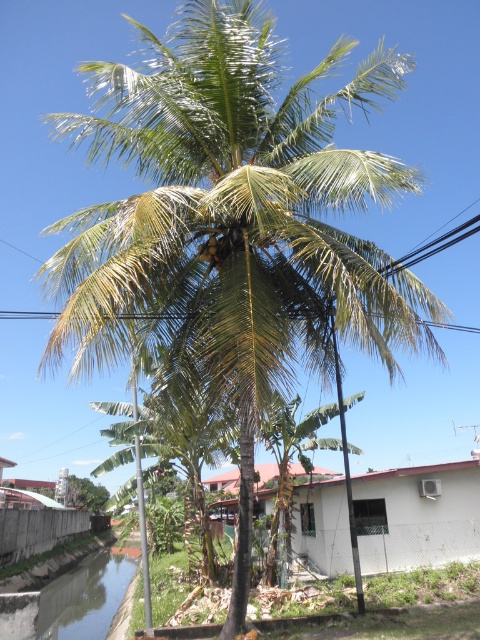
Between green leafy palm tree at center and green leafy coconut at center, which one appears on the right side from the viewer's perspective?

From the viewer's perspective, green leafy palm tree at center appears more on the right side.

Between green leafy palm tree at center and green leafy coconut at center, which one is positioned higher?

Positioned higher is green leafy coconut at center.

The width and height of the screenshot is (480, 640). What do you see at coordinates (290, 456) in the screenshot?
I see `green leafy palm tree at center` at bounding box center [290, 456].

At what (x,y) coordinates should I click in order to perform the action: click on green leafy palm tree at center. Please return your answer as a coordinate pair (x, y). The image size is (480, 640). Looking at the image, I should click on (290, 456).

Consider the image. Which is more to the right, white matte hut at lower center or green leafy palm tree at center?

Positioned to the right is white matte hut at lower center.

Is point (314, 548) more distant than point (307, 438)?

No, (314, 548) is closer to viewer.

Image resolution: width=480 pixels, height=640 pixels. What are the coordinates of `white matte hut at lower center` in the screenshot? It's located at (417, 515).

This screenshot has height=640, width=480. I want to click on white matte hut at lower center, so click(x=417, y=515).

Can you confirm if white matte hut at lower center is positioned above green leafy coconut at center?

No, white matte hut at lower center is not above green leafy coconut at center.

Between point (432, 534) and point (204, 257), which one is positioned in front?

Positioned in front is point (204, 257).

I want to click on white matte hut at lower center, so click(417, 515).